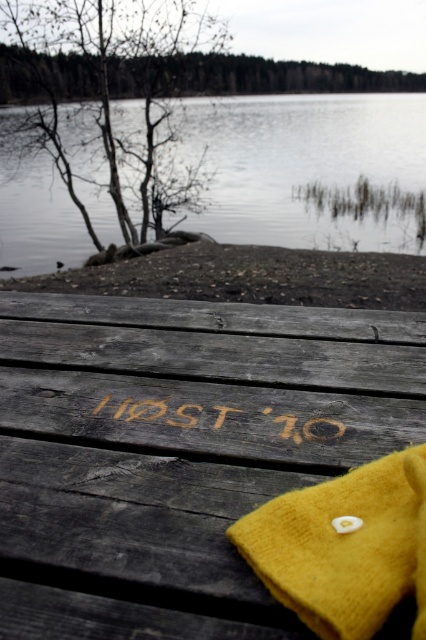
Question: Is wooden plank at center further to camera compared to mustard felt hat at center?

Choices:
 (A) yes
 (B) no

Answer: (A)

Question: Is wooden plank at center above mustard felt hat at center?

Choices:
 (A) no
 (B) yes

Answer: (B)

Question: Estimate the real-world distances between objects in this image. Which object is closer to the gray weathered wood plank at center?

Choices:
 (A) wooden picnic table at center
 (B) carved wood host '10 at center

Answer: (A)

Question: Among these objects, which one is nearest to the camera?

Choices:
 (A) clear water at lake left
 (B) gray weathered wood plank at center

Answer: (B)

Question: Which object appears farthest from the camera in this image?

Choices:
 (A) wooden plank at center
 (B) mustard felt hat at center

Answer: (A)

Question: From the image, what is the correct spatial relationship of wooden plank at center in relation to carved wood host '10 at center?

Choices:
 (A) right
 (B) left

Answer: (B)